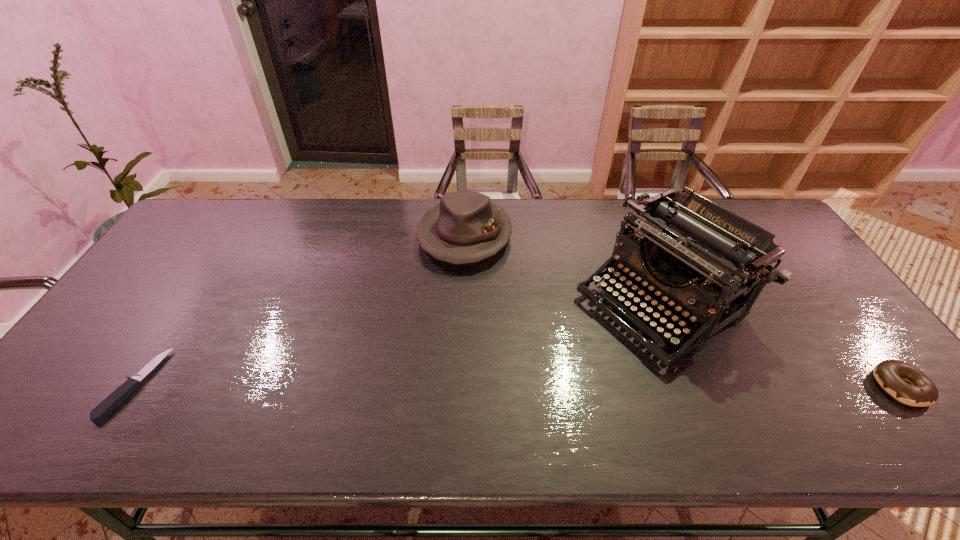
What are the coordinates of `object located in the left edge section of the desktop` in the screenshot? It's located at (116, 398).

Find the location of a particular element. object at the right edge is located at coordinates (920, 391).

The height and width of the screenshot is (540, 960). What are the coordinates of `object that is at the near left corner` in the screenshot? It's located at (116, 398).

Where is `object at the near right corner`? The width and height of the screenshot is (960, 540). object at the near right corner is located at coordinates pyautogui.click(x=920, y=391).

In the image, there is a desktop. At what (x,y) coordinates should I click in order to perform the action: click on free region at the far edge. Please return your answer as a coordinate pair (x, y). Looking at the image, I should click on (372, 199).

In the image, there is a desktop. Where is `vacant space at the near edge`? This screenshot has width=960, height=540. vacant space at the near edge is located at coordinates tap(789, 375).

Locate an element on the screen. The image size is (960, 540). vacant region at the left edge of the desktop is located at coordinates (180, 263).

In the image, there is a desktop. Identify the location of vacant space at the far left corner. The height and width of the screenshot is (540, 960). (206, 215).

The width and height of the screenshot is (960, 540). What are the coordinates of `free space between the rightmost object and the third object from left to right` in the screenshot? It's located at (780, 344).

You are a GUI agent. You are given a task and a screenshot of the screen. Output one action in this format:
    pyautogui.click(x=<x>, y=<y>)
    Task: Click on the vacant space that is in between the shortest object and the second tallest object
    The width and height of the screenshot is (960, 540).
    Given the screenshot: What is the action you would take?
    pyautogui.click(x=300, y=310)